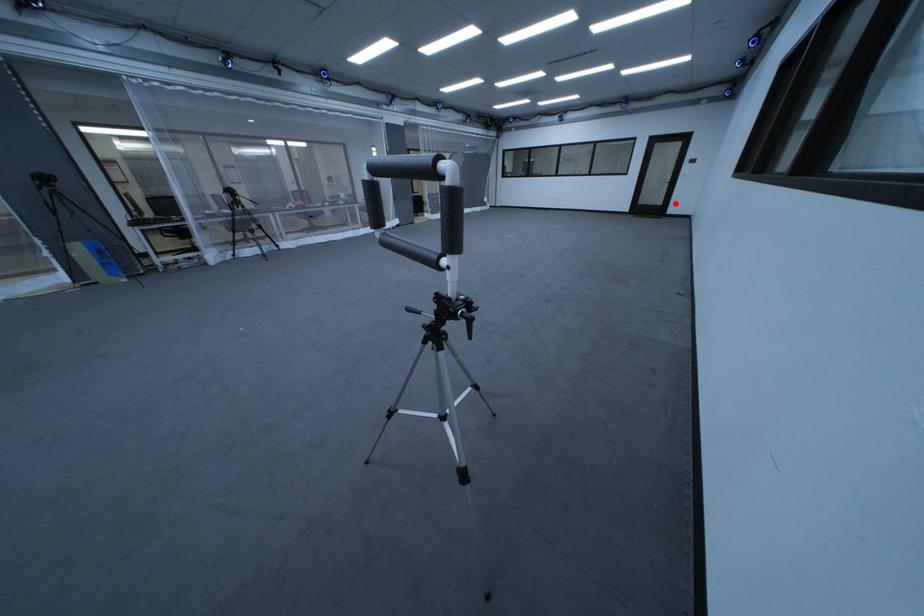
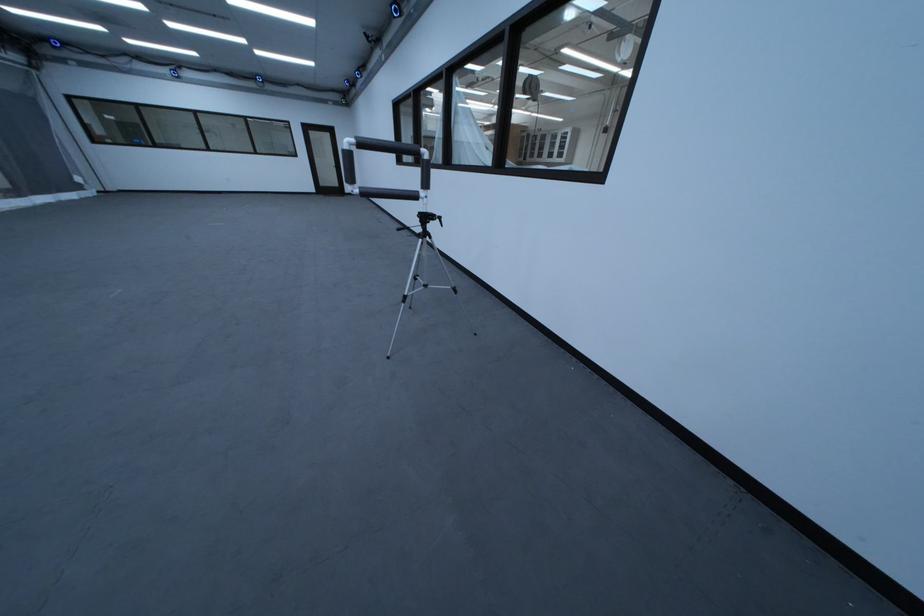
Question: I am providing you with two images of the same scene from different viewpoints. Image1 has a red point marked. In image2, the corresponding 3D location appears at what relative position? Reply with the corresponding letter.

Choices:
 (A) Closer
 (B) Farther

Answer: (B)